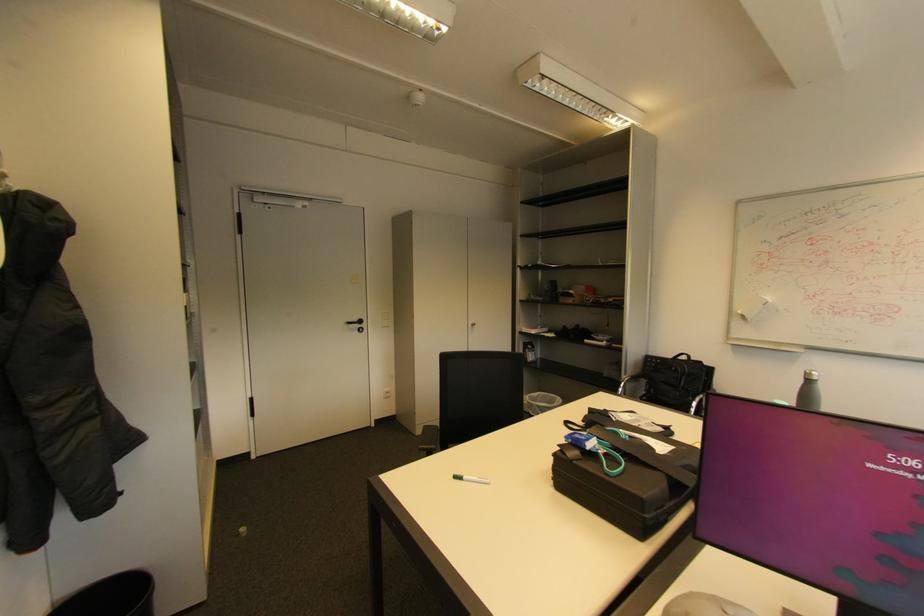
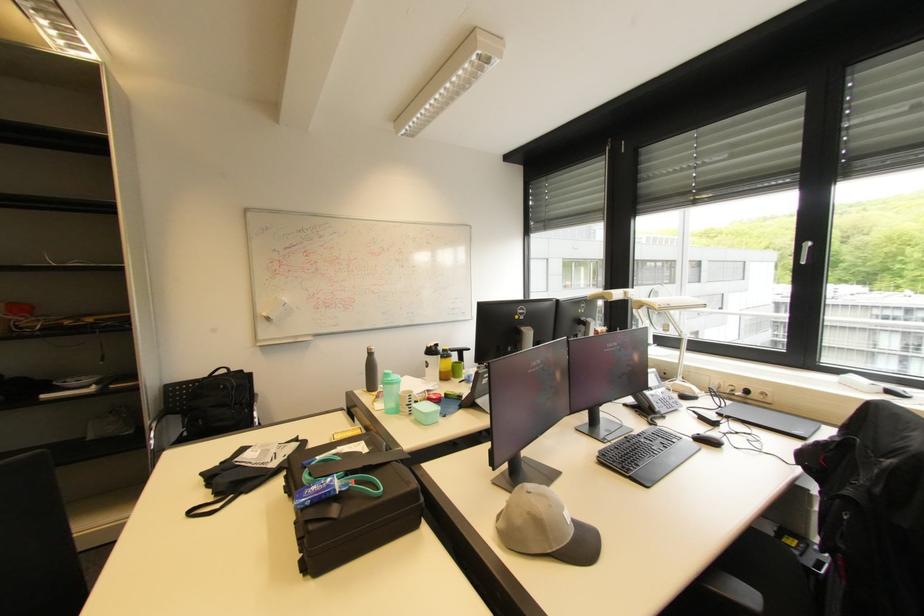
Locate, in the second image, the point that corresponds to point 578,444 in the first image.

(321, 501)